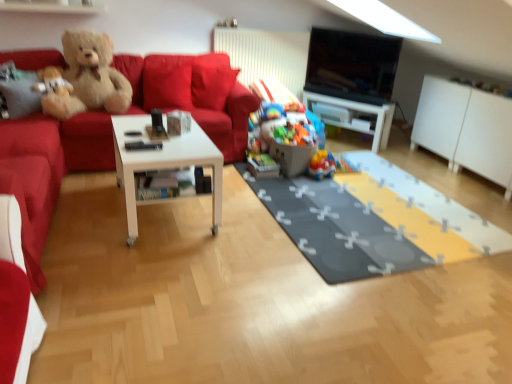
Question: Considering the relative sizes of fluffy beige teddy bear at upper left, the 1th teddy bear in the left-to-right sequence, and white glossy table at center in the image provided, is fluffy beige teddy bear at upper left, the 1th teddy bear in the left-to-right sequence, thinner than white glossy table at center?

Choices:
 (A) yes
 (B) no

Answer: (B)

Question: Is fluffy beige teddy bear at upper left, the 1th teddy bear in the left-to-right sequence, not close to white glossy table at center?

Choices:
 (A) yes
 (B) no

Answer: (A)

Question: From the image's perspective, is fluffy beige teddy bear at upper left, which is counted as the second teddy bear, starting from the right, beneath white glossy table at center?

Choices:
 (A) no
 (B) yes

Answer: (A)

Question: From the image's perspective, is fluffy beige teddy bear at upper left, the 1th teddy bear in the left-to-right sequence, over white glossy table at center?

Choices:
 (A) no
 (B) yes

Answer: (B)

Question: Does fluffy beige teddy bear at upper left, the 1th teddy bear in the left-to-right sequence, appear on the right side of white glossy table at center?

Choices:
 (A) yes
 (B) no

Answer: (B)

Question: Considering the relative sizes of fluffy beige teddy bear at upper left, which is counted as the second teddy bear, starting from the right, and white glossy table at center in the image provided, is fluffy beige teddy bear at upper left, which is counted as the second teddy bear, starting from the right, shorter than white glossy table at center?

Choices:
 (A) no
 (B) yes

Answer: (B)

Question: Is gray fabric mat at center facing towards velvet red couch at left?

Choices:
 (A) no
 (B) yes

Answer: (A)

Question: Is velvet red couch at left at the back of gray fabric mat at center?

Choices:
 (A) no
 (B) yes

Answer: (A)

Question: Is gray fabric mat at center not within velvet red couch at left?

Choices:
 (A) yes
 (B) no

Answer: (A)

Question: Considering the relative sizes of gray fabric mat at center and velvet red couch at left in the image provided, is gray fabric mat at center thinner than velvet red couch at left?

Choices:
 (A) no
 (B) yes

Answer: (B)

Question: Would you say gray fabric mat at center contains velvet red couch at left?

Choices:
 (A) yes
 (B) no

Answer: (B)

Question: Can you confirm if gray fabric mat at center is wider than velvet red couch at left?

Choices:
 (A) no
 (B) yes

Answer: (A)

Question: Is plastic colorful toys at center, marked as the second toy in a right-to-left arrangement, taller than matte red couch at left?

Choices:
 (A) yes
 (B) no

Answer: (B)